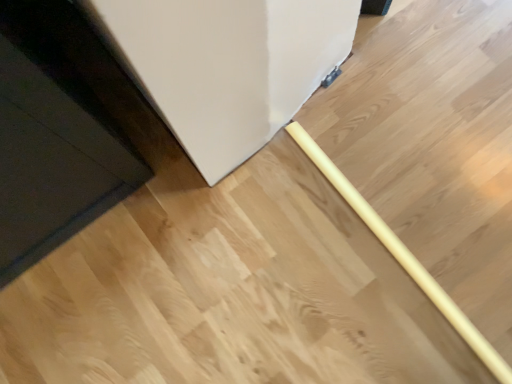
Where is `blank space situated above yellow wood rolling pin at center (from a real-world perspective)`? This screenshot has width=512, height=384. blank space situated above yellow wood rolling pin at center (from a real-world perspective) is located at coordinates (400, 251).